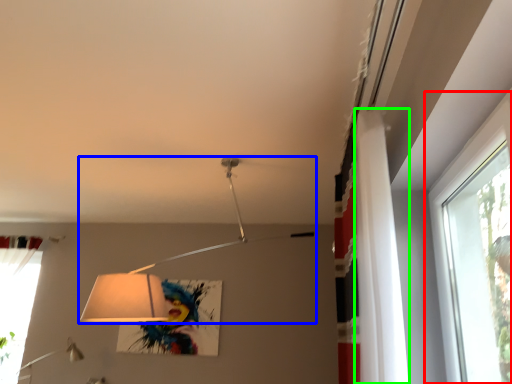
Question: Based on their relative distances, which object is nearer to window (highlighted by a red box)? Choose from lamp (highlighted by a blue box) and curtain (highlighted by a green box).

Choices:
 (A) lamp
 (B) curtain

Answer: (B)